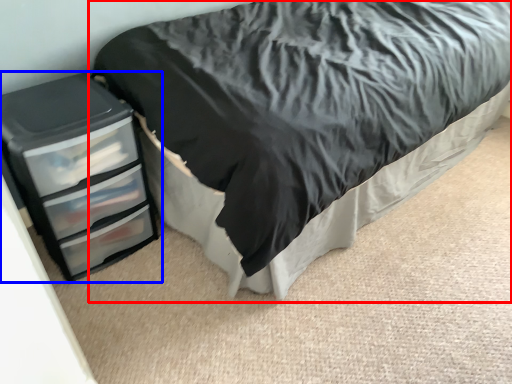
Question: Among these objects, which one is nearest to the camera, bed (highlighted by a red box) or chest of drawers (highlighted by a blue box)?

Choices:
 (A) bed
 (B) chest of drawers

Answer: (A)